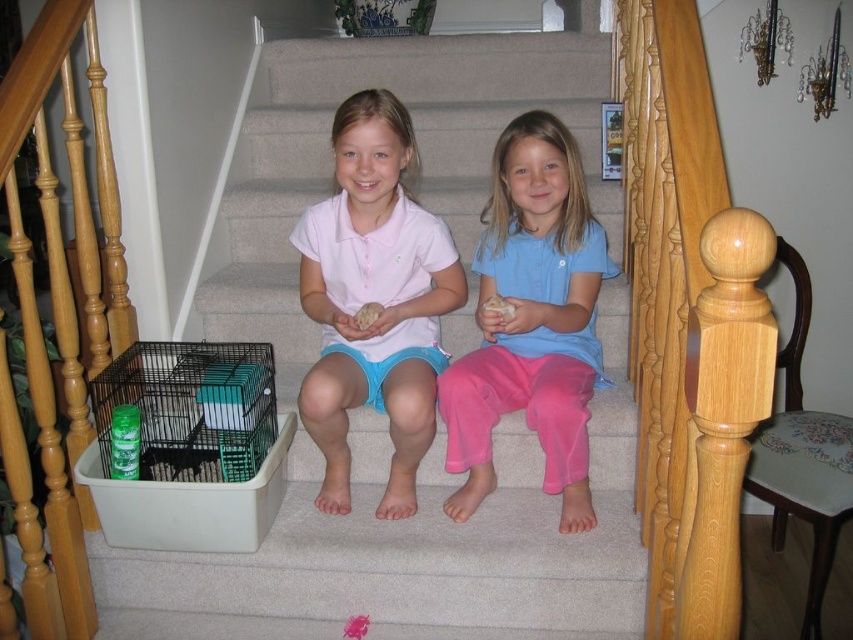
Does point (315, 253) come behind point (566, 236)?

No, (315, 253) is in front of (566, 236).

Does matte pink shirt at center have a lesser width compared to blue cotton shirt at center?

Yes, matte pink shirt at center is thinner than blue cotton shirt at center.

Which is behind, point (352, 285) or point (532, 113)?

Point (352, 285)

You are a GUI agent. You are given a task and a screenshot of the screen. Output one action in this format:
    pyautogui.click(x=<x>, y=<y>)
    Task: Click on the matte pink shirt at center
    The width and height of the screenshot is (853, 640).
    Given the screenshot: What is the action you would take?
    pyautogui.click(x=374, y=300)

Looking at this image, is matte pink shirt at center further to the viewer compared to white fluffy ball at center?

No.

The width and height of the screenshot is (853, 640). I want to click on matte pink shirt at center, so [374, 300].

Where is `matte pink shirt at center`? This screenshot has width=853, height=640. matte pink shirt at center is located at coordinates (374, 300).

Does white carpet at center lie in front of fluffy beige hamster at center?

That is False.

You are a GUI agent. You are given a task and a screenshot of the screen. Output one action in this format:
    pyautogui.click(x=<x>, y=<y>)
    Task: Click on the white carpet at center
    This screenshot has width=853, height=640.
    Given the screenshot: What is the action you would take?
    pyautogui.click(x=412, y=547)

The height and width of the screenshot is (640, 853). I want to click on white carpet at center, so click(x=412, y=547).